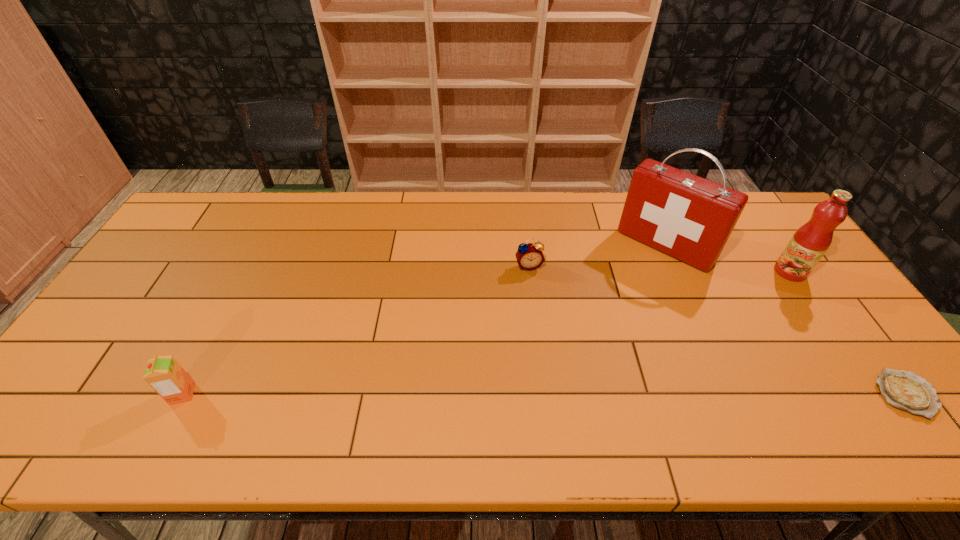
The width and height of the screenshot is (960, 540). I want to click on orange juice that is at the near edge, so click(x=164, y=374).

The width and height of the screenshot is (960, 540). In order to click on quiche situated at the near edge in this screenshot , I will do `click(905, 390)`.

Find the location of a particular element. quiche positioned at the right edge is located at coordinates (905, 390).

Find the location of `fruit juice that is positioned at the right edge`. fruit juice that is positioned at the right edge is located at coordinates (809, 243).

In order to click on object that is at the near right corner in this screenshot , I will do `click(905, 390)`.

You are a GUI agent. You are given a task and a screenshot of the screen. Output one action in this format:
    pyautogui.click(x=<x>, y=<y>)
    Task: Click on the blank space at the far edge of the desktop
    This screenshot has width=960, height=540.
    Given the screenshot: What is the action you would take?
    pyautogui.click(x=380, y=199)

Locate an element on the screen. vacant space at the left edge of the desktop is located at coordinates (185, 288).

The height and width of the screenshot is (540, 960). What are the coordinates of `free point at the right edge` in the screenshot? It's located at (823, 292).

This screenshot has width=960, height=540. Find the location of `vacant space at the far left corner of the desktop`. vacant space at the far left corner of the desktop is located at coordinates (197, 214).

The width and height of the screenshot is (960, 540). In the image, there is a desktop. In order to click on vacant space at the far right corner in this screenshot , I will do `click(759, 210)`.